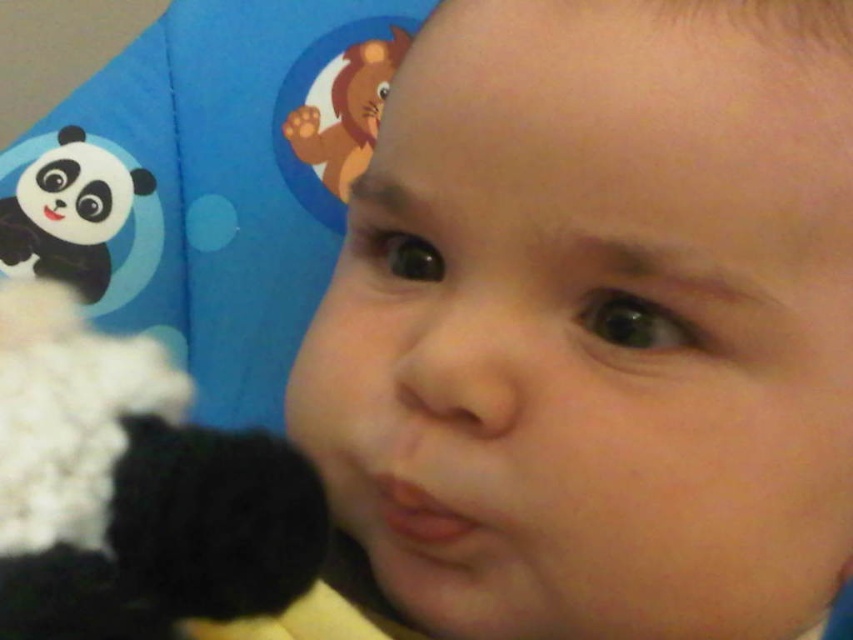
Who is positioned more to the right, fuzzy black and white plush at left or black plush panda at left?

Positioned to the right is fuzzy black and white plush at left.

Identify the location of fuzzy black and white plush at left. (132, 488).

You are a GUI agent. You are given a task and a screenshot of the screen. Output one action in this format:
    pyautogui.click(x=<x>, y=<y>)
    Task: Click on the fuzzy black and white plush at left
    The width and height of the screenshot is (853, 640).
    Given the screenshot: What is the action you would take?
    pyautogui.click(x=132, y=488)

Where is `smooth skin baby at center`? This screenshot has height=640, width=853. smooth skin baby at center is located at coordinates (598, 323).

What are the coordinates of `smooth skin baby at center` in the screenshot? It's located at (598, 323).

How far apart are black plush panda at left and matte plastic lion at upper left?

A distance of 5.72 inches exists between black plush panda at left and matte plastic lion at upper left.

Between black plush panda at left and matte plastic lion at upper left, which one is positioned higher?

matte plastic lion at upper left

Is point (49, 272) closer to camera compared to point (285, 132)?

Yes.

What are the coordinates of `black plush panda at left` in the screenshot? It's located at (79, 216).